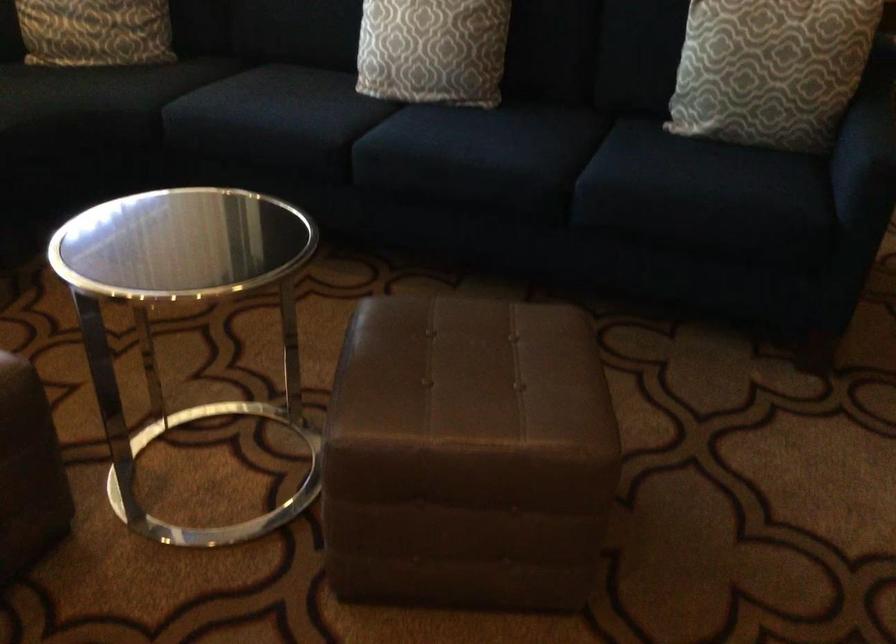
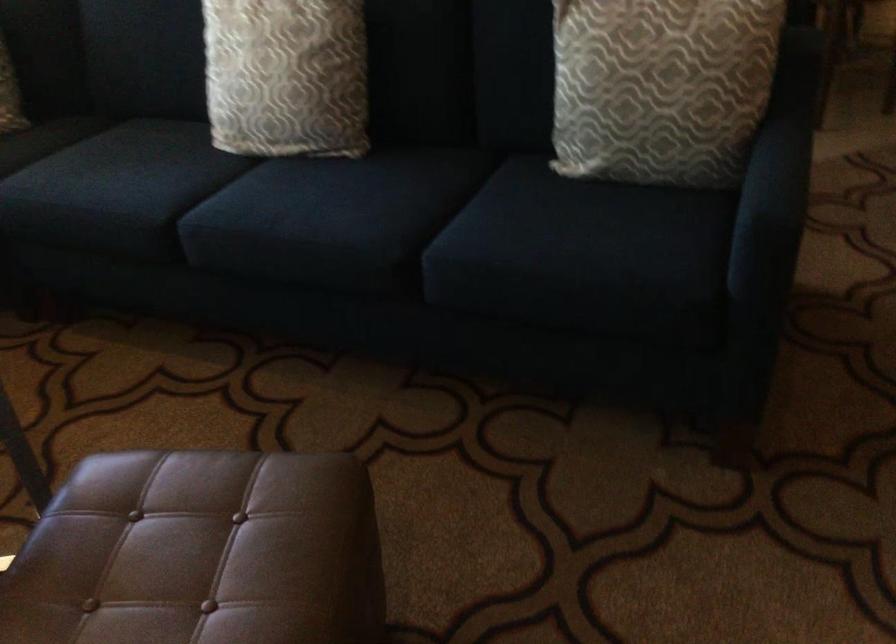
The images are taken continuously from a first-person perspective. In which direction are you moving?

The cameraman walked toward right, forward.